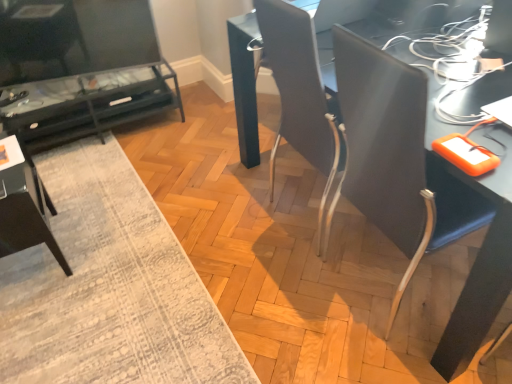
What do you see at coordinates (79, 69) in the screenshot?
I see `matte black tv stand at left, the 2th table from the right` at bounding box center [79, 69].

In order to face dark gray fabric armchair at lower left, should I rotate leftwards or rightwards?

Rotate left and turn 29.716 degrees.

Identify the location of matte black table at center, the 2th table positioned from the left. This screenshot has height=384, width=512. (382, 21).

Locate an element on the screen. The image size is (512, 384). textured gray rug at lower left is located at coordinates (109, 287).

At what (x,y) coordinates should I click in order to perform the action: click on matte black tv stand at left, the 2th table from the right. Please return your answer as a coordinate pair (x, y). The height and width of the screenshot is (384, 512). Looking at the image, I should click on pos(79,69).

Is dark gray fabric armchair at lower left completely or partially inside matte black table at center, the 1th table from the right?

No, matte black table at center, the 1th table from the right, does not contain dark gray fabric armchair at lower left.

From the picture: Is matte black table at center, the 2th table positioned from the left, positioned with its back to dark gray fabric armchair at lower left?

matte black table at center, the 2th table positioned from the left, is not turned away from dark gray fabric armchair at lower left.

From a real-world perspective, is matte black table at center, which is the first table from front to back, positioned above or below dark gray fabric armchair at lower left?

matte black table at center, which is the first table from front to back, is situated higher than dark gray fabric armchair at lower left in the real world.

How distant is matte black table at center, the 2th table positioned from the left, from dark gray fabric armchair at lower left?

A distance of 1.14 meters exists between matte black table at center, the 2th table positioned from the left, and dark gray fabric armchair at lower left.

From the picture: From the image's perspective, who appears lower, matte black table at center, the 1th table from the right, or textured gray rug at lower left?

textured gray rug at lower left, from the image's perspective.

Is matte black table at center, which ranks as the second table in back-to-front order, bigger or smaller than textured gray rug at lower left?

Considering their sizes, matte black table at center, which ranks as the second table in back-to-front order, takes up more space than textured gray rug at lower left.

Is matte black table at center, which is the first table from front to back, positioned with its back to textured gray rug at lower left?

Correct, matte black table at center, which is the first table from front to back, is looking away from textured gray rug at lower left.

Does dark gray fabric armchair at lower left appear on the right side of matte black tv stand at left, the 2th table from the right?

In fact, dark gray fabric armchair at lower left is to the left of matte black tv stand at left, the 2th table from the right.

From a real-world perspective, is dark gray fabric armchair at lower left above or below matte black tv stand at left, the 2th table from the right?

In terms of real-world spatial position, dark gray fabric armchair at lower left is above matte black tv stand at left, the 2th table from the right.

In the scene shown: Would you say dark gray fabric armchair at lower left is a long distance from matte black tv stand at left, which ranks as the 2th table in front-to-back order?

No, dark gray fabric armchair at lower left is not far away from matte black tv stand at left, which ranks as the 2th table in front-to-back order.

Does dark gray fabric armchair at lower left turn towards matte black desk at center?

No, dark gray fabric armchair at lower left does not turn towards matte black desk at center.

Who is bigger, dark gray fabric armchair at lower left or matte black desk at center?

matte black desk at center is bigger.

Which is more to the right, dark gray fabric armchair at lower left or matte black desk at center?

Positioned to the right is matte black desk at center.

Can you confirm if dark gray fabric armchair at lower left is taller than matte black desk at center?

In fact, dark gray fabric armchair at lower left may be shorter than matte black desk at center.

Is dark gray fabric armchair at lower left surrounded by textured gray rug at lower left?

No, textured gray rug at lower left does not contain dark gray fabric armchair at lower left.

From the image's perspective, which is above, textured gray rug at lower left or dark gray fabric armchair at lower left?

dark gray fabric armchair at lower left is shown above in the image.

Considering the points (173, 343) and (6, 254), which point is in front, point (173, 343) or point (6, 254)?

Positioned in front is point (173, 343).

Are textured gray rug at lower left and dark gray fabric armchair at lower left far apart?

That's not correct — textured gray rug at lower left is a little close to dark gray fabric armchair at lower left.

Does dark gray fabric armchair at lower left turn towards textured gray rug at lower left?

No.

From a real-world perspective, is dark gray fabric armchair at lower left physically above textured gray rug at lower left?

Yes, from a real-world perspective, dark gray fabric armchair at lower left is on top of textured gray rug at lower left.

From the image's perspective, is dark gray fabric armchair at lower left above or below textured gray rug at lower left?

dark gray fabric armchair at lower left is situated higher than textured gray rug at lower left in the image.

Which object is thinner, dark gray fabric armchair at lower left or textured gray rug at lower left?

dark gray fabric armchair at lower left.

Which of these two, matte black desk at center or textured gray rug at lower left, is thinner?

textured gray rug at lower left.

From a real-world perspective, does matte black desk at center stand above textured gray rug at lower left?

Indeed, from a real-world perspective, matte black desk at center stands above textured gray rug at lower left.

Identify the location of desk in front of the textured gray rug at lower left. (418, 160).

Consider the image. Are matte black desk at center and textured gray rug at lower left making contact?

matte black desk at center and textured gray rug at lower left are not in contact.

Locate an element on the screen. armchair behind the matte black table at center, the 2th table positioned from the left is located at coordinates (23, 205).

Where is `mat that appears in front of the matte black table at center, the 2th table positioned from the left`? The image size is (512, 384). mat that appears in front of the matte black table at center, the 2th table positioned from the left is located at coordinates (109, 287).

Considering their positions, is matte black desk at center positioned closer to matte black table at center, the 1th table from the right, than matte black tv stand at left, the first table from the back?

matte black desk at center.

Estimate the real-world distances between objects in this image. Which object is closer to matte black tv stand at left, the first table from the back, textured gray rug at lower left or matte black table at center, the 2th table positioned from the left?

textured gray rug at lower left is closer to matte black tv stand at left, the first table from the back.

Looking at the image, which one is located closer to textured gray rug at lower left, dark gray fabric armchair at lower left or matte black tv stand at left, which ranks as the first table in left-to-right order?

dark gray fabric armchair at lower left is positioned closer to the anchor textured gray rug at lower left.

Estimate the real-world distances between objects in this image. Which object is closer to matte black table at center, which ranks as the second table in back-to-front order, matte black tv stand at left, which ranks as the 2th table in front-to-back order, or dark gray fabric armchair at lower left?

dark gray fabric armchair at lower left is closer to matte black table at center, which ranks as the second table in back-to-front order.

From the image, which object appears to be nearer to matte black table at center, the 2th table positioned from the left, dark gray fabric armchair at lower left or textured gray rug at lower left?

textured gray rug at lower left is positioned closer to the anchor matte black table at center, the 2th table positioned from the left.

Considering their positions, is matte black desk at center positioned further to matte black tv stand at left, which ranks as the first table in left-to-right order, than dark gray fabric armchair at lower left?

matte black desk at center.

Estimate the real-world distances between objects in this image. Which object is further from matte black desk at center, textured gray rug at lower left or matte black table at center, which is the first table from front to back?

textured gray rug at lower left.

Looking at the image, which one is located further to matte black tv stand at left, the first table from the back, dark gray fabric armchair at lower left or matte black table at center, which ranks as the second table in back-to-front order?

matte black table at center, which ranks as the second table in back-to-front order, is further to matte black tv stand at left, the first table from the back.

Image resolution: width=512 pixels, height=384 pixels. I want to click on mat between matte black tv stand at left, which ranks as the first table in left-to-right order, and matte black table at center, the 1th table from the right, in the horizontal direction, so (x=109, y=287).

I want to click on mat between dark gray fabric armchair at lower left and matte black desk at center, so tap(109, 287).

You are a GUI agent. You are given a task and a screenshot of the screen. Output one action in this format:
    pyautogui.click(x=<x>, y=<y>)
    Task: Click on the table located between dark gray fabric armchair at lower left and matte black table at center, which is the first table from front to back, in the left-right direction
    
    Given the screenshot: What is the action you would take?
    pyautogui.click(x=79, y=69)

The width and height of the screenshot is (512, 384). What are the coordinates of `table situated between textured gray rug at lower left and matte black desk at center from left to right` in the screenshot? It's located at (382, 21).